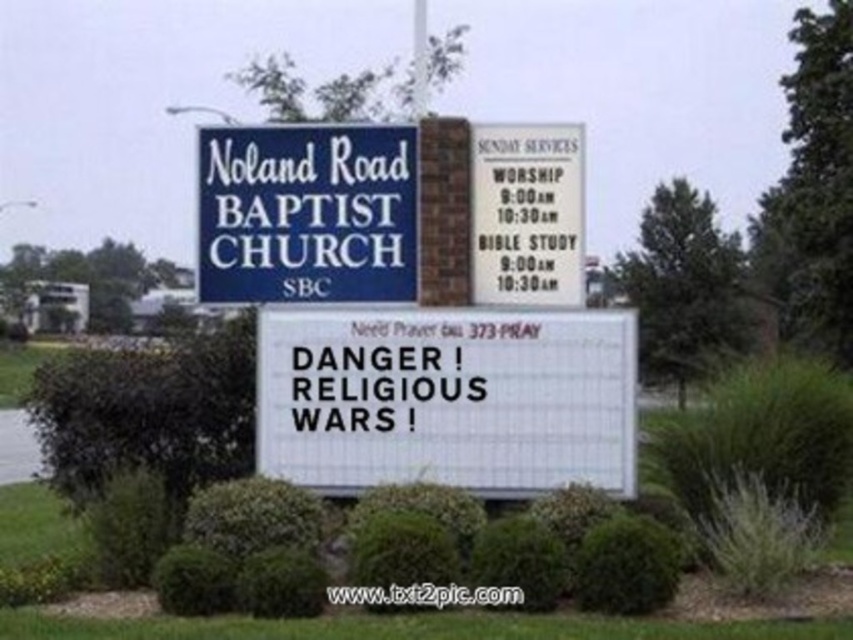
Question: Does white plastic sign at center appear over blue painted wood sign at upper center?

Choices:
 (A) no
 (B) yes

Answer: (A)

Question: Is white plastic sign at center wider than blue painted wood sign at upper center?

Choices:
 (A) no
 (B) yes

Answer: (B)

Question: Which point is closer to the camera?

Choices:
 (A) white plastic sign at center
 (B) blue painted wood sign at upper center

Answer: (A)

Question: Is white plastic sign at center to the right of blue painted wood sign at upper center from the viewer's perspective?

Choices:
 (A) no
 (B) yes

Answer: (B)